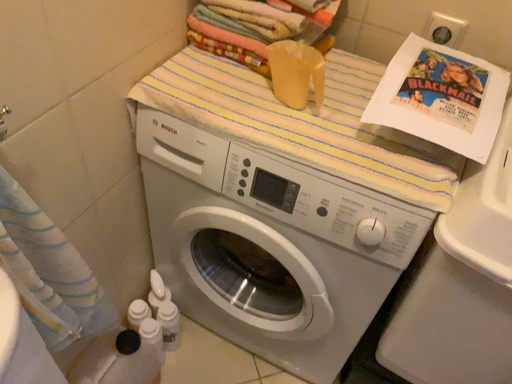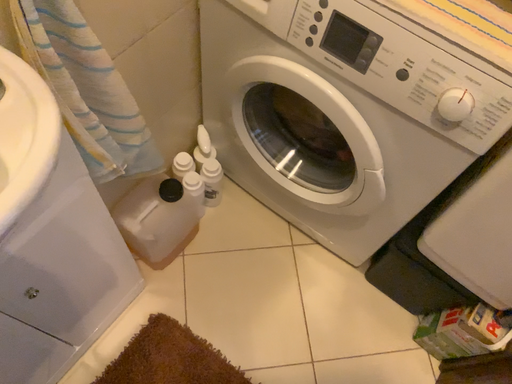
Question: Which way did the camera rotate in the video?

Choices:
 (A) rotated right
 (B) rotated left

Answer: (B)